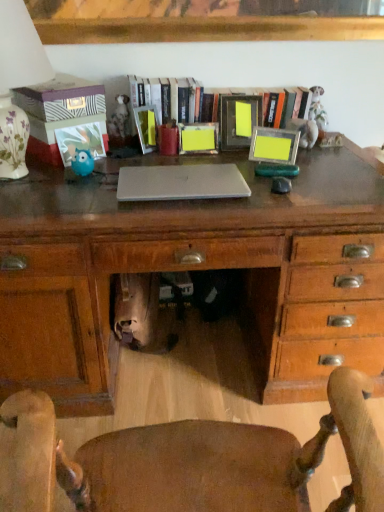
Where is `vacant space to the left of satin silver laptop at center`? vacant space to the left of satin silver laptop at center is located at coordinates (79, 197).